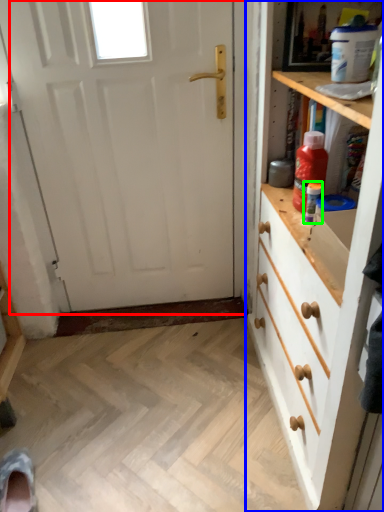
Question: Considering the real-world distances, which object is farthest from door (highlighted by a red box)? chest of drawers (highlighted by a blue box) or bottle (highlighted by a green box)?

Choices:
 (A) chest of drawers
 (B) bottle

Answer: (B)